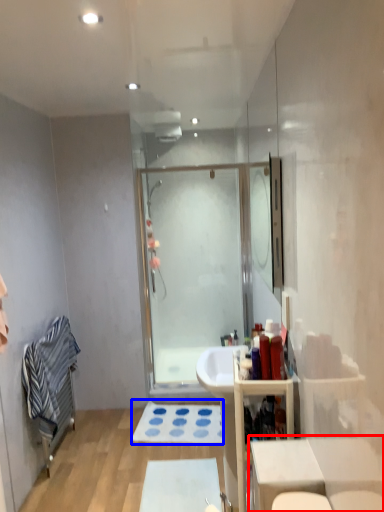
Question: Which of the following is the farthest to the observer, table (highlighted by a red box) or bath mat (highlighted by a blue box)?

Choices:
 (A) table
 (B) bath mat

Answer: (B)